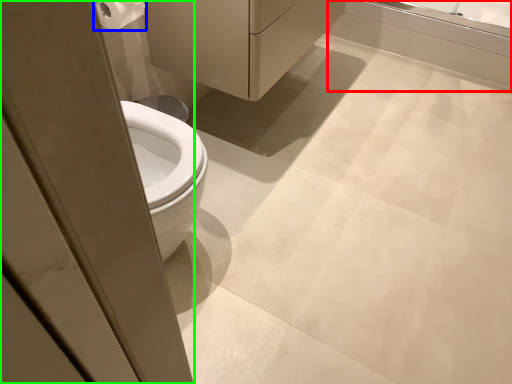
Question: Which is farther away from bath (highlighted by a red box)? toilet paper (highlighted by a blue box) or screen door (highlighted by a green box)?

Choices:
 (A) toilet paper
 (B) screen door

Answer: (B)